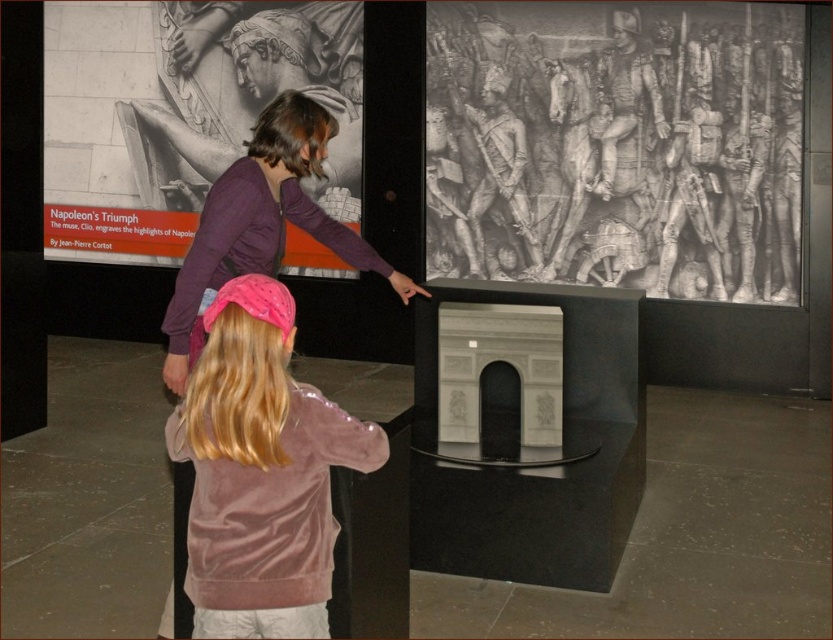
Who is taller, gray stone relief at upper right or matte gray stone arch at upper center?

gray stone relief at upper right

Is gray stone relief at upper right to the left of matte gray stone arch at upper center from the viewer's perspective?

Incorrect, gray stone relief at upper right is not on the left side of matte gray stone arch at upper center.

You are a GUI agent. You are given a task and a screenshot of the screen. Output one action in this format:
    pyautogui.click(x=<x>, y=<y>)
    Task: Click on the gray stone relief at upper right
    
    Given the screenshot: What is the action you would take?
    pyautogui.click(x=617, y=145)

Measure the distance from velvet pink jacket at lower center to matte gray stone arch at upper center.

The distance of velvet pink jacket at lower center from matte gray stone arch at upper center is 16.18 feet.

Between point (278, 305) and point (217, 86), which one is positioned in front?

Positioned in front is point (278, 305).

Does point (212, 397) come in front of point (237, 51)?

Yes, point (212, 397) is closer to viewer.

Where is `velvet pink jacket at lower center`? The height and width of the screenshot is (640, 833). velvet pink jacket at lower center is located at coordinates (260, 472).

In the scene shown: Can you confirm if matte gray stone arch at upper center is smaller than pink velvet headband at upper center?

No.

Can you confirm if matte gray stone arch at upper center is wider than pink velvet headband at upper center?

Yes, matte gray stone arch at upper center is wider than pink velvet headband at upper center.

This screenshot has height=640, width=833. Identify the location of matte gray stone arch at upper center. (248, 90).